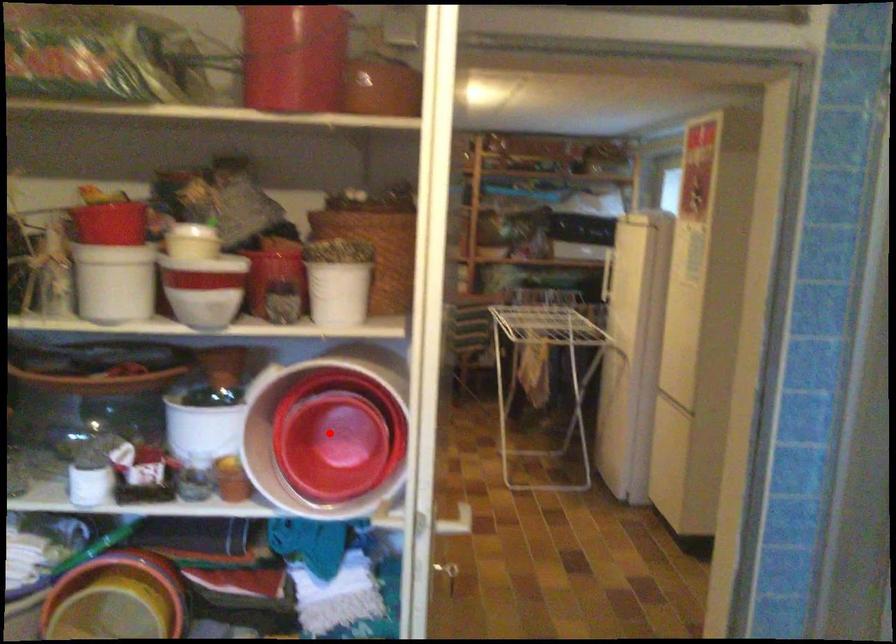
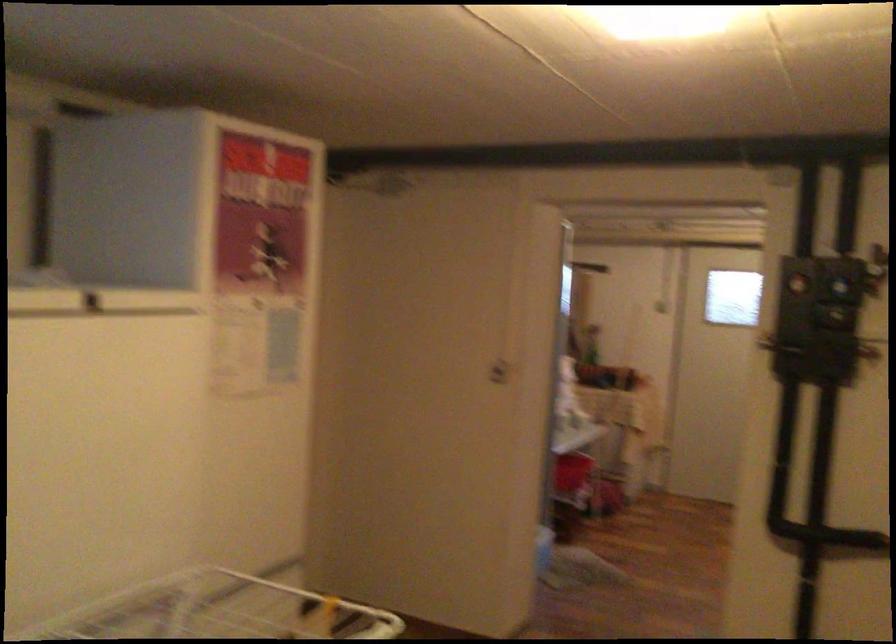
Question: I am providing you with two images of the same scene from different viewpoints. A red point is marked on the first image. Is the red point's position out of view in image 2?

Choices:
 (A) Yes
 (B) No

Answer: (A)